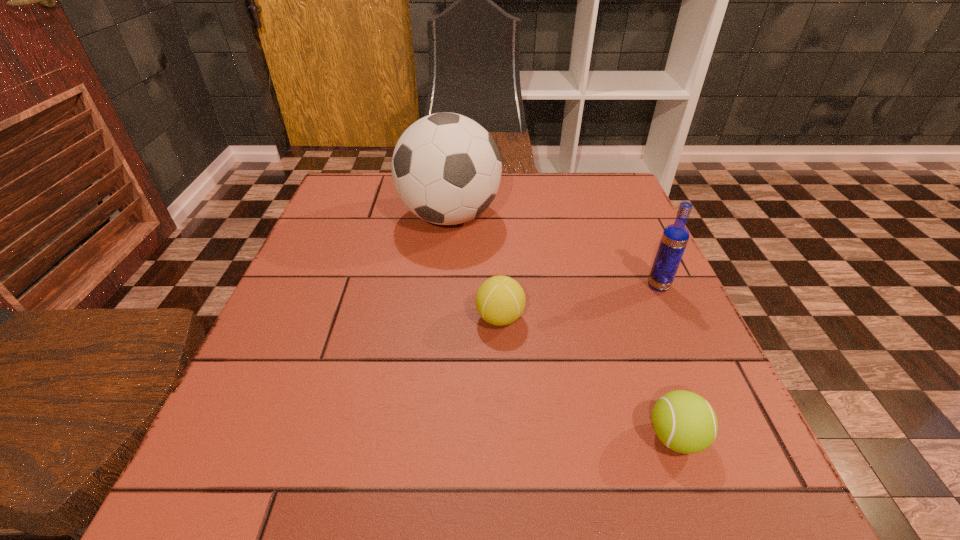
Identify the location of vacant region located 0.140m on the right of the second nearest object. (597, 318).

Identify the location of vacant space located on the back of the second object from right to left. (619, 281).

Locate an element on the screen. The image size is (960, 540). object that is positioned at the far edge is located at coordinates (446, 168).

Find the location of a particular element. The width and height of the screenshot is (960, 540). object positioned at the near edge is located at coordinates (685, 422).

This screenshot has height=540, width=960. What are the coordinates of `vodka located at the right edge` in the screenshot? It's located at (675, 237).

Find the location of a particular element. tennis ball that is at the right edge is located at coordinates (685, 422).

The image size is (960, 540). I want to click on object that is at the near right corner, so pyautogui.click(x=685, y=422).

The image size is (960, 540). I want to click on vacant space at the far edge, so click(559, 190).

Locate an element on the screen. vacant point at the near edge is located at coordinates (362, 477).

This screenshot has height=540, width=960. I want to click on free space at the left edge of the desktop, so click(302, 294).